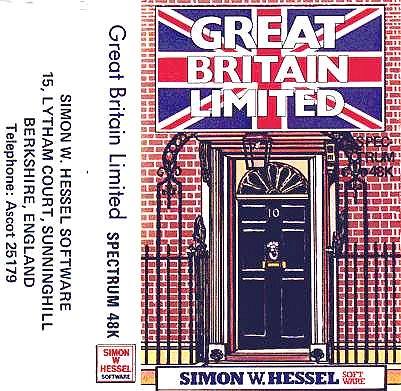
Where is `door handle`? This screenshot has width=401, height=391. door handle is located at coordinates click(x=274, y=246).